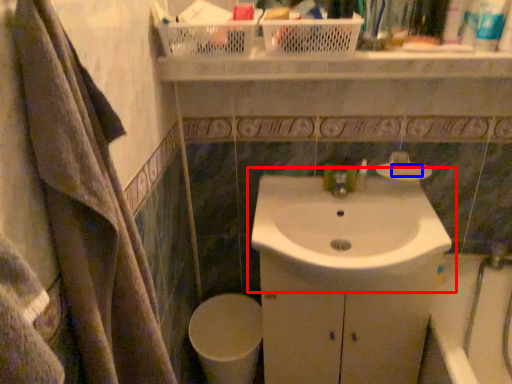
Question: Among these objects, which one is farthest to the camera, sink (highlighted by a red box) or soap (highlighted by a blue box)?

Choices:
 (A) sink
 (B) soap

Answer: (B)